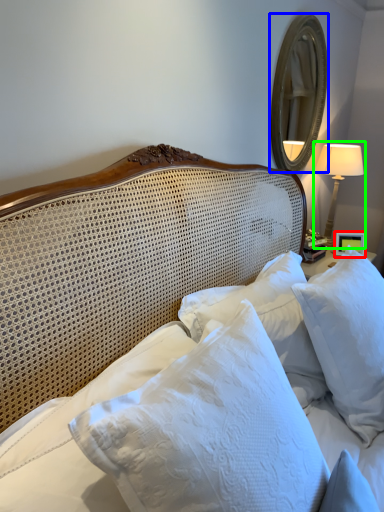
Question: Considering the real-world distances, which object is closest to picture frame (highlighted by a red box)? mirror (highlighted by a blue box) or bedside lamp (highlighted by a green box).

Choices:
 (A) mirror
 (B) bedside lamp

Answer: (B)